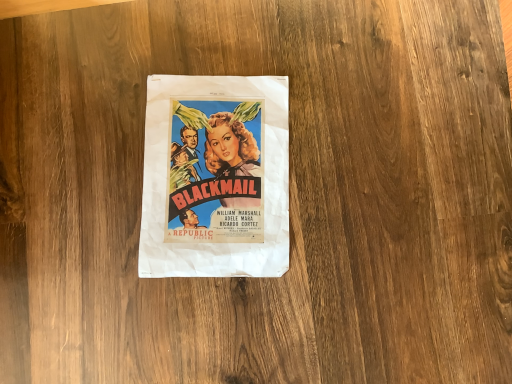
Image resolution: width=512 pixels, height=384 pixels. Describe the element at coordinates (215, 177) in the screenshot. I see `matte paper poster at center` at that location.

Locate an element on the screen. matte paper poster at center is located at coordinates (215, 177).

Locate an element on the screen. Image resolution: width=512 pixels, height=384 pixels. matte paper poster at center is located at coordinates (215, 177).